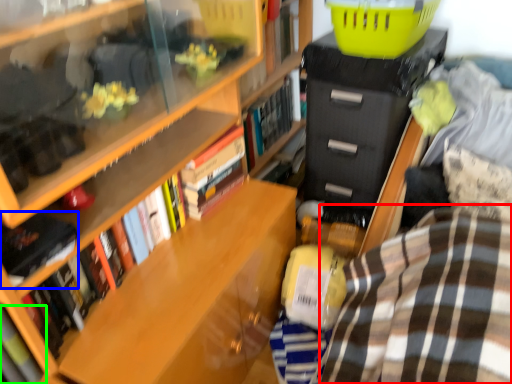
Question: Which object is the closest to the plaid (highlighted by a red box)? Choose among these: book (highlighted by a blue box) or book (highlighted by a green box).

Choices:
 (A) book
 (B) book

Answer: (A)